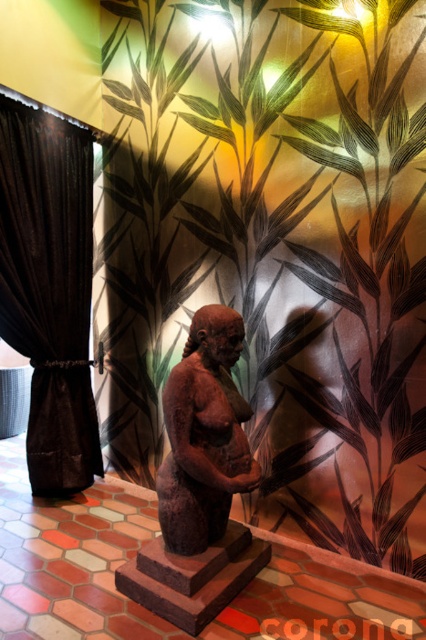
Question: Is green leafy plant at center behind brown clay figurine at center?

Choices:
 (A) no
 (B) yes

Answer: (B)

Question: Which point is closer to the camera?

Choices:
 (A) black velvet curtain at left
 (B) green leafy plant at center
 (C) brown clay figurine at center

Answer: (C)

Question: Which object appears farthest from the camera in this image?

Choices:
 (A) green leafy plant at center
 (B) black velvet curtain at left
 (C) brown clay figurine at center

Answer: (B)

Question: Which point is farther to the camera?

Choices:
 (A) brown clay figurine at center
 (B) black velvet curtain at left
 (C) green leafy plant at center

Answer: (B)

Question: In this image, where is black velvet curtain at left located relative to brown clay figurine at center?

Choices:
 (A) right
 (B) left

Answer: (B)

Question: Does black velvet curtain at left have a smaller size compared to brown clay figurine at center?

Choices:
 (A) yes
 (B) no

Answer: (B)